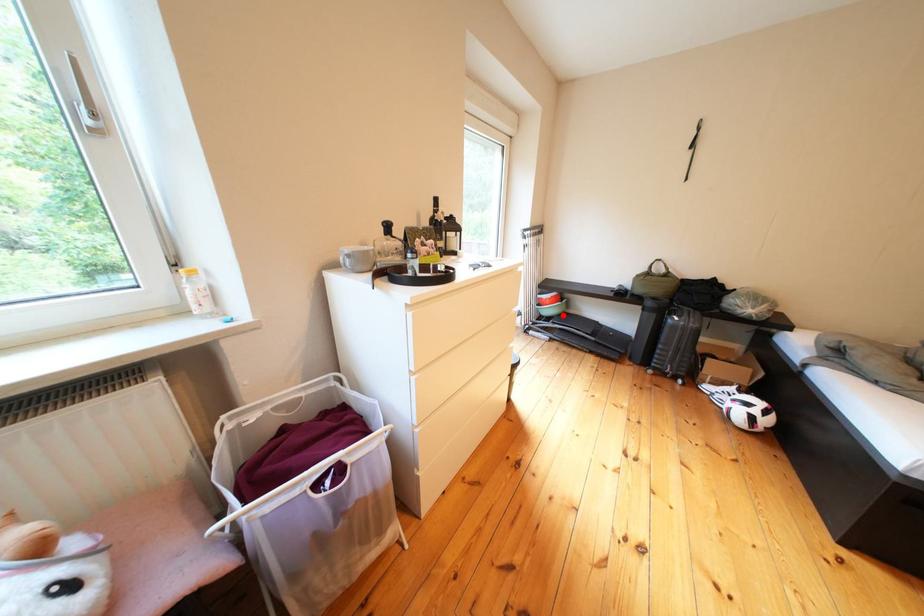
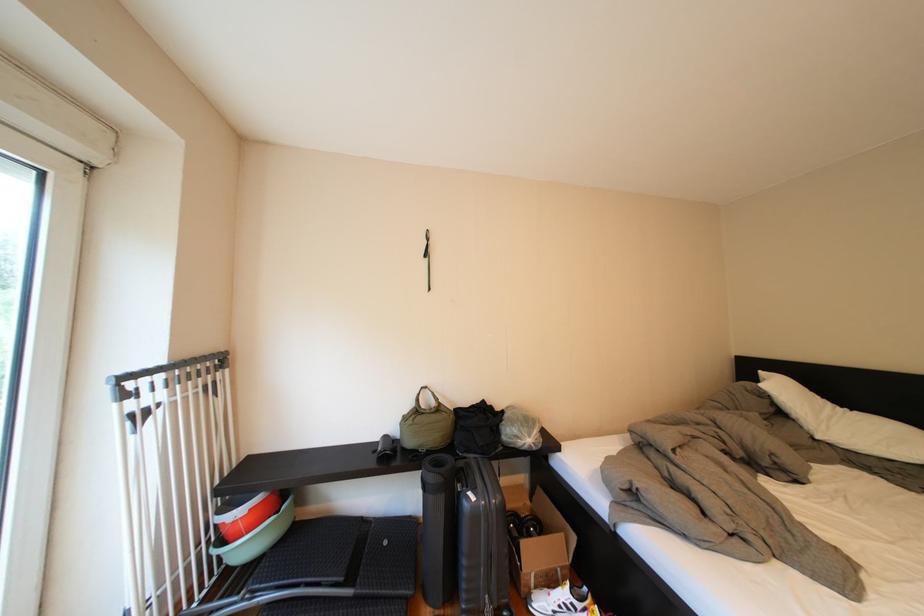
Question: I am providing you with two images of the same scene from different viewpoints. A red point is shown in image1. For the corresponding object point in image2, is it positioned nearer or farther from the camera?

Choices:
 (A) Nearer
 (B) Farther

Answer: (B)